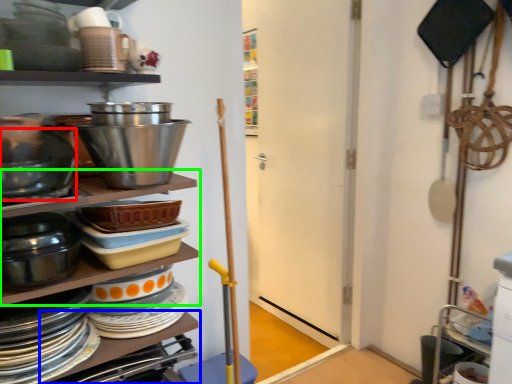
Question: Estimate the real-world distances between objects in this image. Which object is closer to bowl (highlighted by a red box), table (highlighted by a blue box) or shelf (highlighted by a green box)?

Choices:
 (A) table
 (B) shelf

Answer: (B)